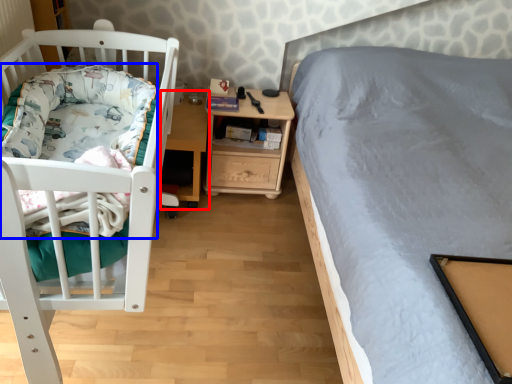
Question: Which point is closer to the camera, table (highlighted by a red box) or blanket (highlighted by a blue box)?

Choices:
 (A) table
 (B) blanket

Answer: (B)